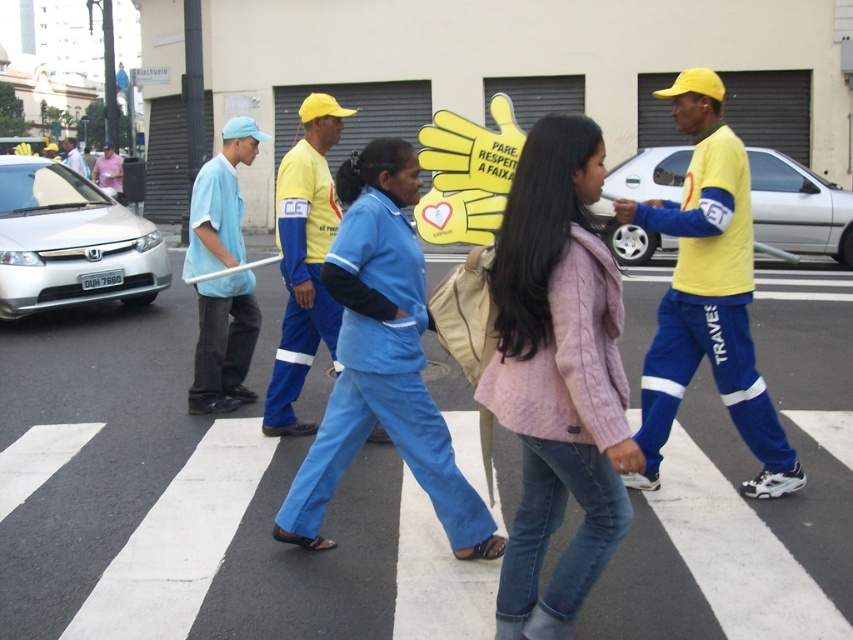
You are a photographer standing at the crosswalk and want to take a photo of the blue fabric uniform at center and the light blue fabric shirt at center. Which one is on the right side when looking towards the crosswalk?

The blue fabric uniform at center is positioned on the right side of light blue fabric shirt at center, so when looking towards the crosswalk, the blue fabric uniform at center is on the right side.

Consider the image. You are a photographer standing on the sidewalk. You want to take a photo of the pink textured jacket at center and the matte blue shirt at left. Which one will appear larger in your photo?

The pink textured jacket at center will appear larger in the photo because it is closer to the viewer than the matte blue shirt at left.

Looking at this image, you are a photographer trying to capture the entire group of people in the crosswalk. You notice two individuals wearing blue shirts, the matte blue shirt at left and the light blue fabric shirt at center. Based on their size in the photo, which one might be closer to the camera?

The matte blue shirt at left occupies less space than the light blue fabric shirt at center, so the light blue fabric shirt at center is closer to the camera because objects closer to the camera appear larger.